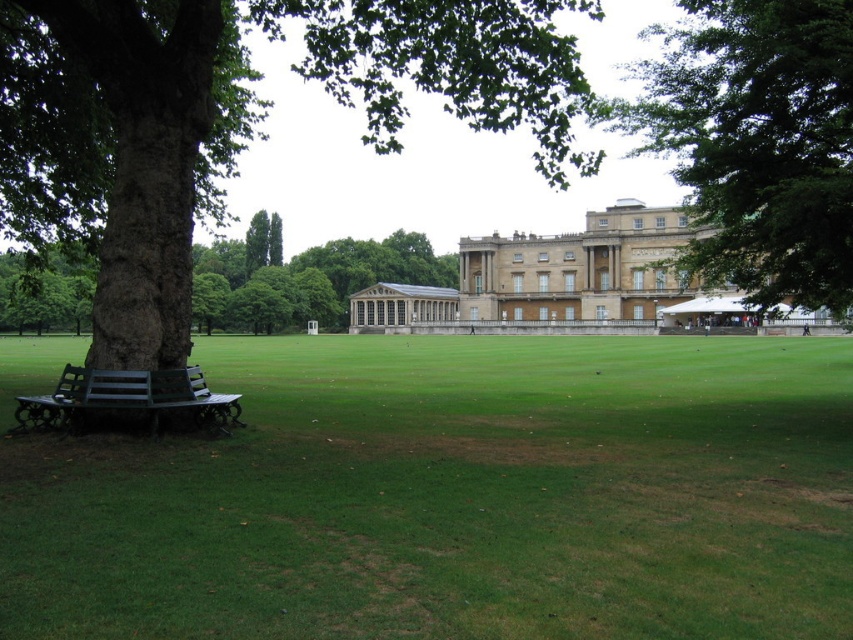
Which is below, green grass at lower center or beige stone palace at center?

Positioned lower is green grass at lower center.

Does green grass at lower center appear on the right side of beige stone palace at center?

No, green grass at lower center is not to the right of beige stone palace at center.

Does point (258, 436) come closer to viewer compared to point (735, 314)?

Yes, point (258, 436) is in front of point (735, 314).

Where is `green grass at lower center`? This screenshot has width=853, height=640. green grass at lower center is located at coordinates (456, 497).

Between beige stone palace at center and brown rough bark tree at left, which one appears on the right side from the viewer's perspective?

beige stone palace at center

Locate an element on the screen. beige stone palace at center is located at coordinates (558, 278).

Where is `beige stone palace at center`? Image resolution: width=853 pixels, height=640 pixels. beige stone palace at center is located at coordinates (558, 278).

Where is `beige stone palace at center`? beige stone palace at center is located at coordinates (558, 278).

Which is in front, point (461, 248) or point (204, 380)?

Point (204, 380) is more forward.

Identify the location of beige stone palace at center. This screenshot has width=853, height=640. (558, 278).